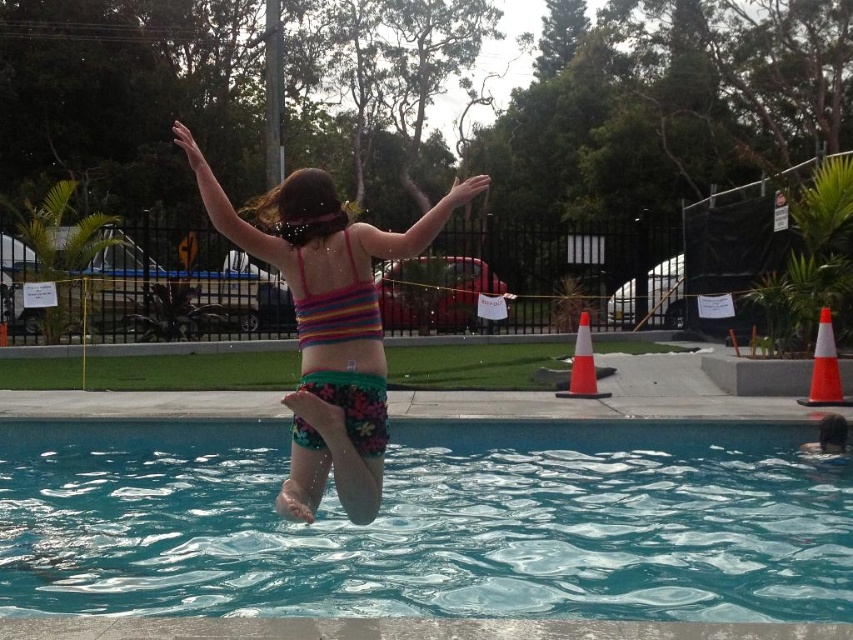
You are standing at the edge of the pool and want to throw a beach ball to the multicolored fabric bikini at center. Is the distance within the range of a standard beach ball throw?

The multicolored fabric bikini at center is 3.41 meters away from the camera. A standard beach ball throw can reach up to 10 meters, so yes, the distance is within range.

From the picture: You are standing at the edge of the pool and see two points marked in the image. Which point is closer to you, point [688,490] or point [325,376]?

Point [688,490] is further to the viewer than point [325,376], so the closer point to you is point [325,376].